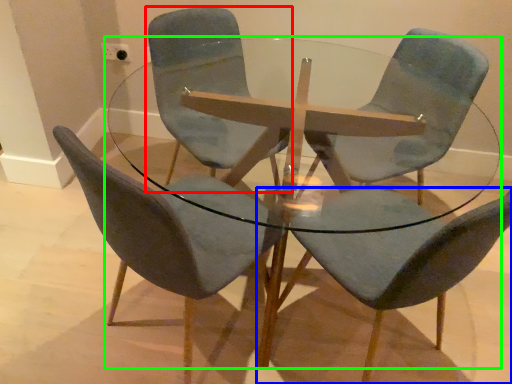
Question: Which object is positioned closest to chair (highlighted by a red box)? Select from chair (highlighted by a blue box) and coffee table (highlighted by a green box).

Choices:
 (A) chair
 (B) coffee table

Answer: (B)